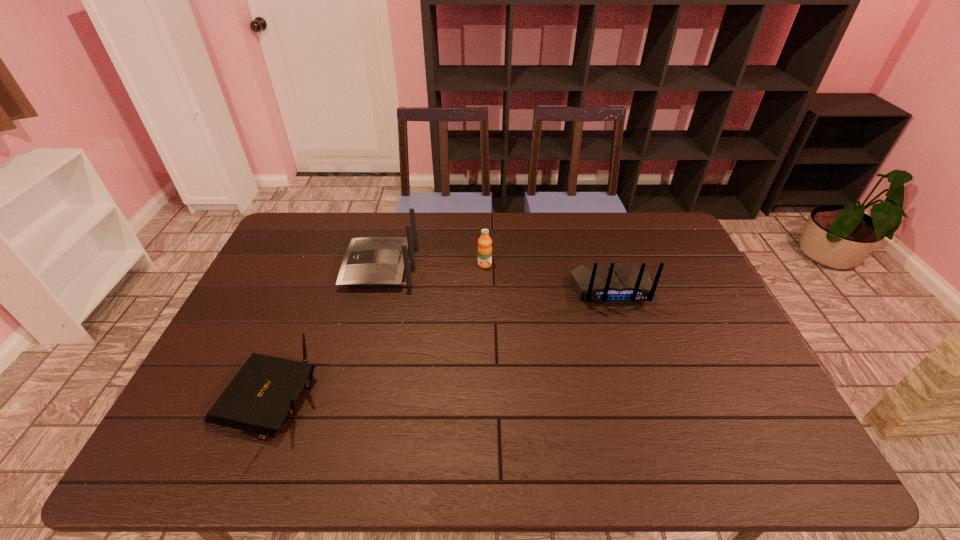
Locate an element on the screen. This screenshot has height=540, width=960. the rightmost router is located at coordinates (620, 284).

At what (x,y) coordinates should I click in order to perform the action: click on the second object from right to left. Please return your answer as a coordinate pair (x, y). The image size is (960, 540). Looking at the image, I should click on (484, 242).

The height and width of the screenshot is (540, 960). Find the location of `the third tallest object`. the third tallest object is located at coordinates (484, 242).

Identify the location of the shortest object. The width and height of the screenshot is (960, 540). (257, 400).

Locate an element on the screen. The height and width of the screenshot is (540, 960). the nearest router is located at coordinates (257, 400).

Identify the location of vacant space located on the back of the rightmost router. This screenshot has height=540, width=960. (637, 370).

Find the location of `free region located on the label of the third object from left to right`. free region located on the label of the third object from left to right is located at coordinates (486, 313).

Identify the location of free spot located on the back of the shortest object. This screenshot has height=540, width=960. (320, 276).

Find the location of a particular element. Image resolution: width=960 pixels, height=540 pixels. object at the far edge is located at coordinates (369, 261).

The image size is (960, 540). Find the location of `object positioned at the near edge`. object positioned at the near edge is located at coordinates (257, 400).